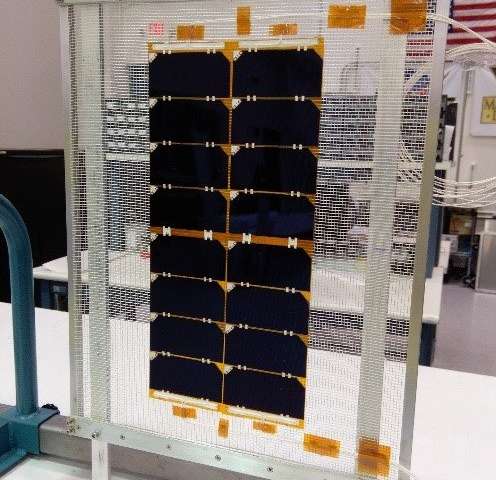
Locate an element on the screen. Image resolution: width=496 pixels, height=480 pixels. screen is located at coordinates (341, 248).